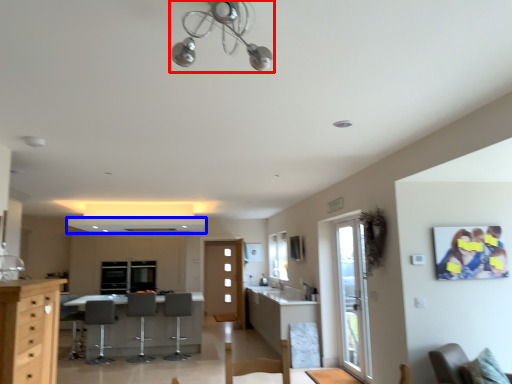
Question: Which point is further to the camera, light fixture (highlighted by a red box) or exhaust hood (highlighted by a blue box)?

Choices:
 (A) light fixture
 (B) exhaust hood

Answer: (B)